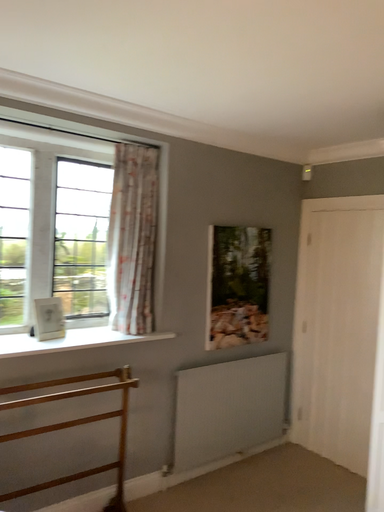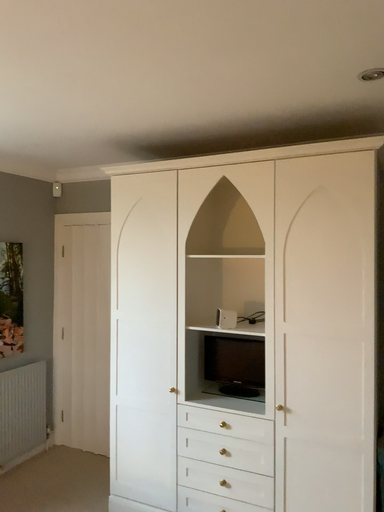
Question: Which way did the camera rotate in the video?

Choices:
 (A) rotated left
 (B) rotated right

Answer: (B)